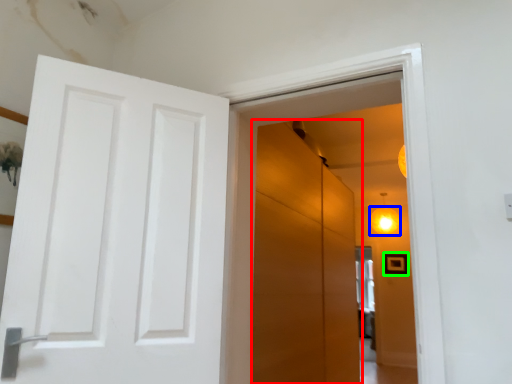
Question: Which object is the farthest from screen door (highlighted by a red box)? Choose among these: lighting (highlighted by a blue box) or picture frame (highlighted by a green box).

Choices:
 (A) lighting
 (B) picture frame

Answer: (B)